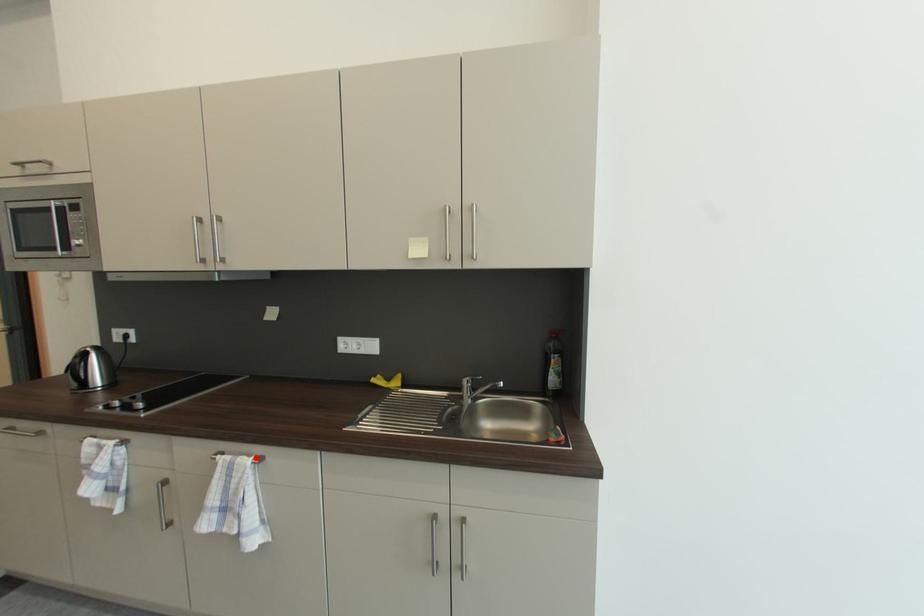
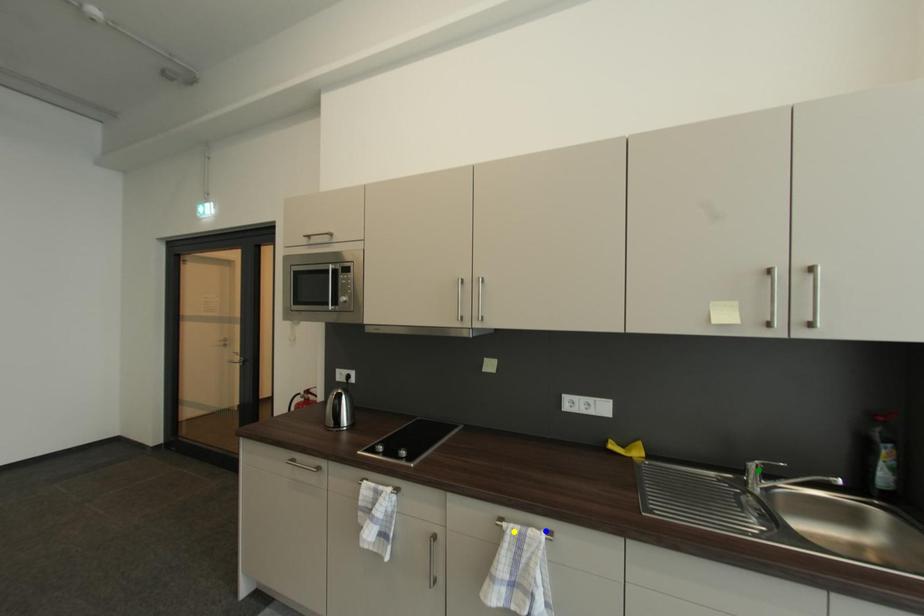
Question: I am providing you with two images of the same scene from different viewpoints. A red point is marked on the first image. You are given multiple points on the second image. Which point in image 2 is actually the same real-world point as the red point in image 1?

Choices:
 (A) blue point
 (B) green point
 (C) yellow point

Answer: (A)